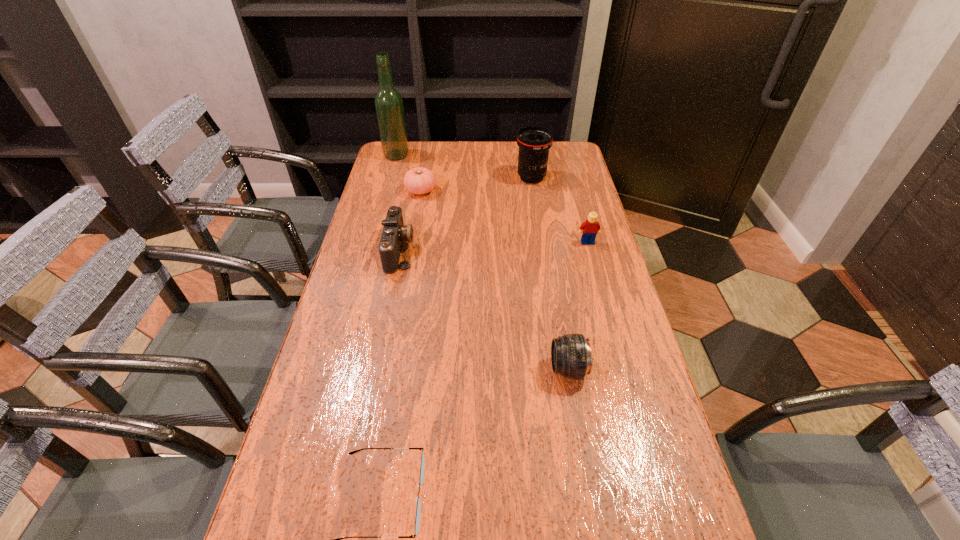
Where is `camera that is at the left edge`? camera that is at the left edge is located at coordinates (394, 232).

Identify the location of tomato that is at the left edge. Image resolution: width=960 pixels, height=540 pixels. (419, 180).

Find the location of a particular element. The image size is (960, 540). Lego that is positioned at the right edge is located at coordinates (591, 228).

Locate an element on the screen. object that is at the far left corner is located at coordinates (389, 108).

You are a GUI agent. You are given a task and a screenshot of the screen. Output one action in this format:
    pyautogui.click(x=<x>, y=<y>)
    Task: Click on the object at the far right corner
    
    Given the screenshot: What is the action you would take?
    pyautogui.click(x=534, y=142)

I want to click on vacant space at the far edge of the desktop, so click(x=518, y=149).

Image resolution: width=960 pixels, height=540 pixels. Find the location of `vacant space at the left edge of the desktop`. vacant space at the left edge of the desktop is located at coordinates (283, 477).

Locate an element on the screen. vacant space at the right edge of the desktop is located at coordinates (585, 178).

Identify the location of free region at the far right corner of the desktop. (550, 159).

Locate an element on the screen. The image size is (960, 540). vacant space that is in between the liquor and the second nearest object is located at coordinates pos(482,262).